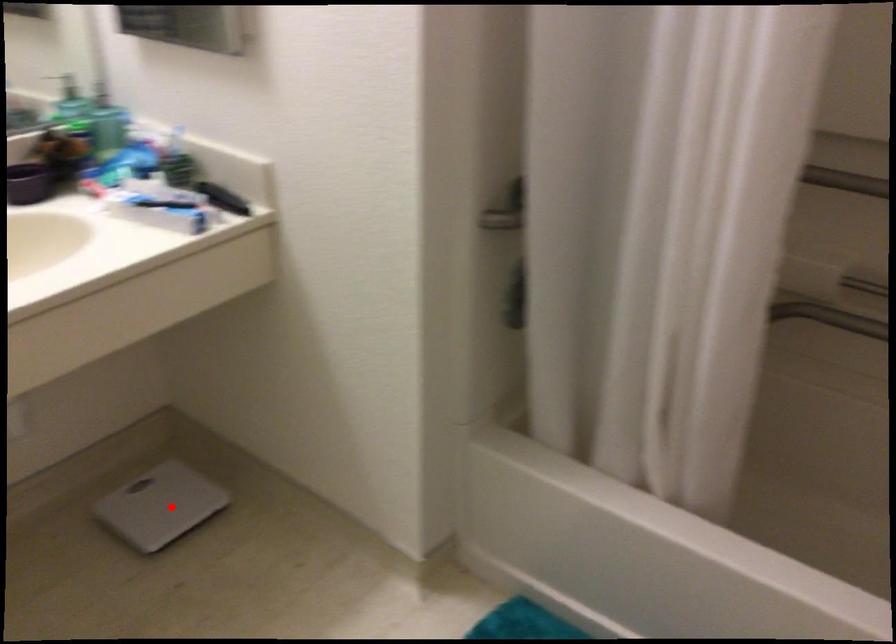
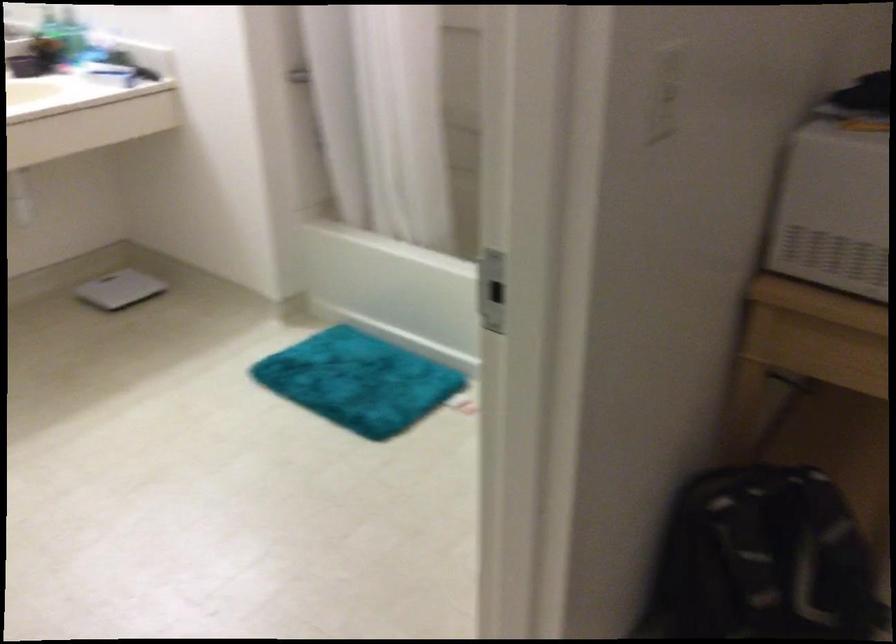
Question: I am providing you with two images of the same scene from different viewpoints. Image1 has a red point marked. In image2, the corresponding 3D location appears at what relative position? Reply with the corresponding letter.

Choices:
 (A) Closer
 (B) Farther

Answer: (B)